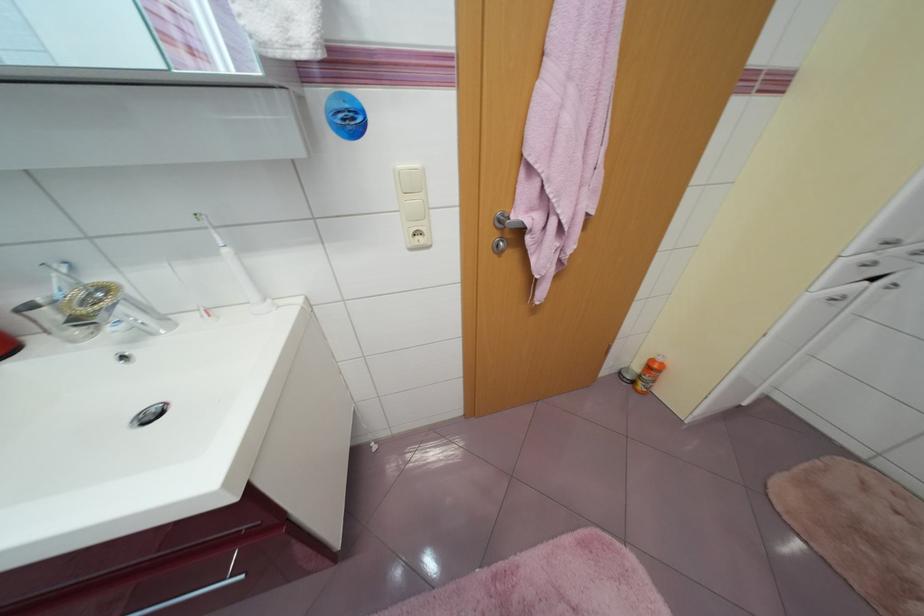
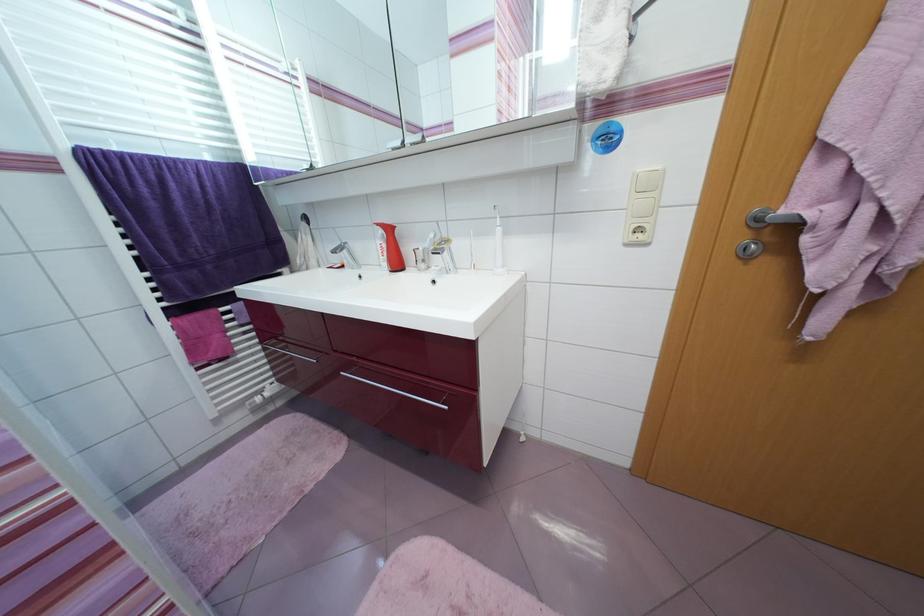
In the second image, find the point that corresponds to [37,308] in the first image.

(423, 251)